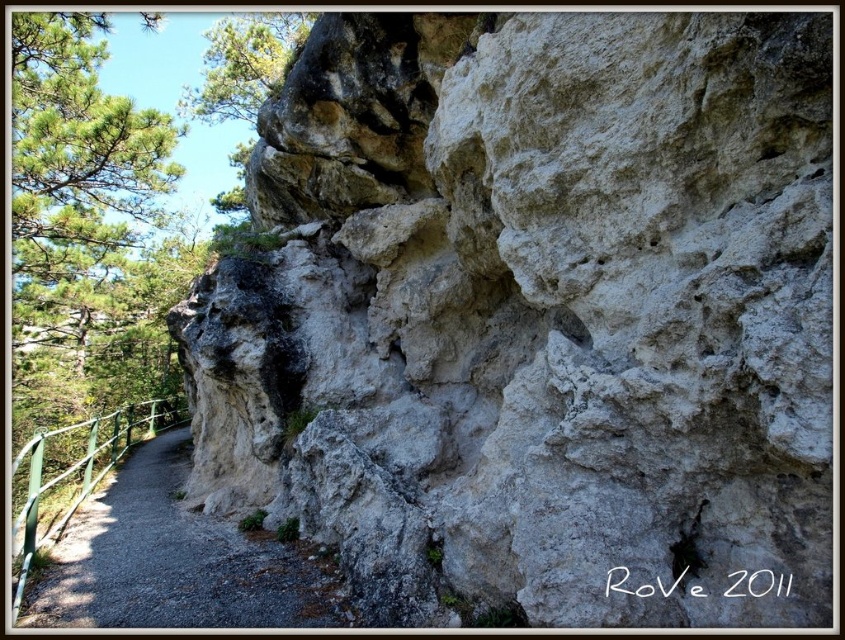
You are a hiker carrying a backpack and need to cross the gray gravel path at lower left and the green metal rail at lower left. The width of your backpack is 2 feet. Can you safely pass through the space between them?

The gray gravel path at lower left is 5.89 feet away from the green metal rail at lower left. Since your backpack is 2 feet wide, you can safely pass through the space between them as the distance is more than sufficient.

You are standing at the base of the cliff and want to reach a specific point marked at coordinates point (134, 582). Given that the distance from you to this point is 2.88 meters, can you estimate how far you need to walk to reach it?

The distance to point (134, 582) is 2.88 meters, so you need to walk approximately 2.88 meters to reach it.

You are a hiker standing at the start of the gray gravel path at lower left and want to walk along the path while keeping the green metal rail at lower left on your left side. Which direction should you face to start walking?

To keep the green metal rail at lower left on your left side while walking along the gray gravel path at lower left, you should face towards the right side of the path. Since the gray gravel path at lower left is positioned on the right side of the green metal rail at lower left, facing right along the path will keep the rail to your left.